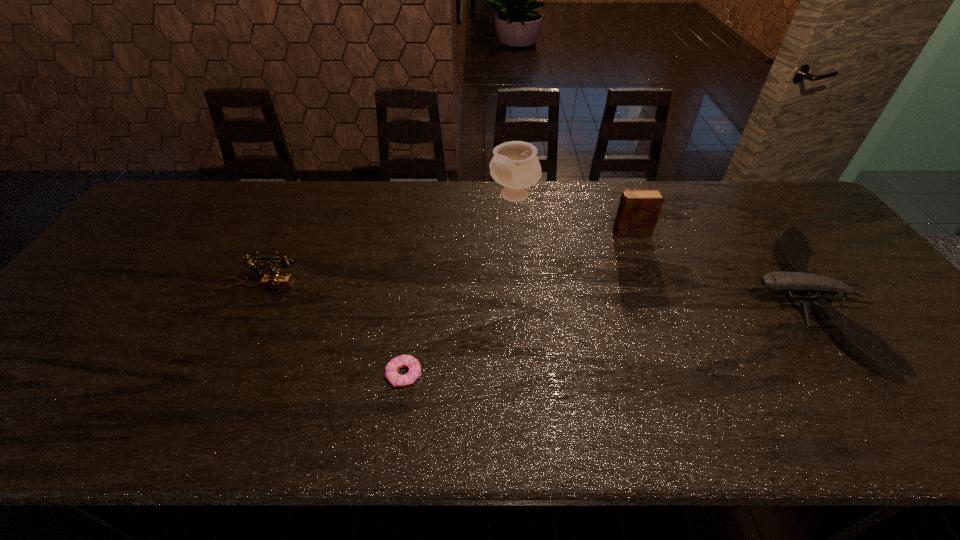
Find the location of a particular element. The height and width of the screenshot is (540, 960). vacant space at the near edge is located at coordinates (37, 434).

In the image, there is a desktop. Where is `vacant space at the left edge`? This screenshot has width=960, height=540. vacant space at the left edge is located at coordinates (95, 300).

You are a GUI agent. You are given a task and a screenshot of the screen. Output one action in this format:
    pyautogui.click(x=<x>, y=<y>)
    Task: Click on the free space at the right edge of the desktop
    Image resolution: width=960 pixels, height=540 pixels.
    Given the screenshot: What is the action you would take?
    pyautogui.click(x=924, y=346)

Image resolution: width=960 pixels, height=540 pixels. Find the location of `vacant region at the far right corner of the desktop`. vacant region at the far right corner of the desktop is located at coordinates (797, 197).

You are a GUI agent. You are given a task and a screenshot of the screen. Output one action in this format:
    pyautogui.click(x=<x>, y=<y>)
    Task: Click on the vacant space that is in between the leftmost object and the farthest object
    
    Given the screenshot: What is the action you would take?
    pyautogui.click(x=387, y=241)

This screenshot has height=540, width=960. I want to click on free space that is in between the telephone and the rightmost object, so click(x=532, y=293).

This screenshot has width=960, height=540. I want to click on unoccupied position between the doughnut and the diary, so click(517, 303).

This screenshot has height=540, width=960. Find the location of `vacant area between the fourth shortest object and the telephone`. vacant area between the fourth shortest object and the telephone is located at coordinates (445, 259).

This screenshot has width=960, height=540. I want to click on free space between the third object from left to right and the telephone, so click(x=387, y=241).

Where is `free area in between the doughnut and the fourth shortest object`? free area in between the doughnut and the fourth shortest object is located at coordinates (517, 303).